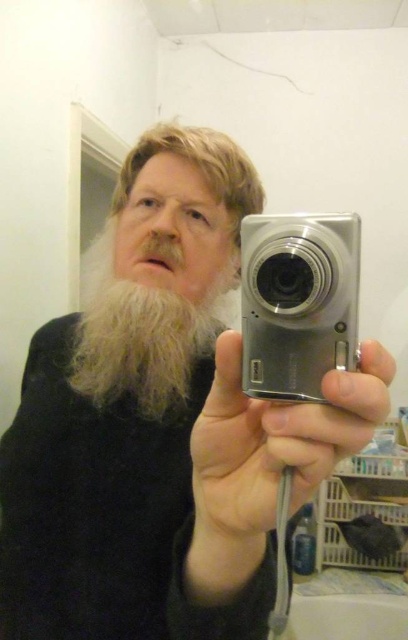
Question: Which of the following is the closest to the observer?

Choices:
 (A) (166, 340)
 (B) (305, 392)

Answer: (B)

Question: Which point is farther from the camera taking this photo?

Choices:
 (A) (102, 272)
 (B) (246, 285)

Answer: (A)

Question: Is silver metallic camera at center closer to the viewer compared to light brown fuzzy beard at center?

Choices:
 (A) yes
 (B) no

Answer: (A)

Question: Among these points, which one is farthest from the camera?

Choices:
 (A) (106, 248)
 (B) (330, 298)

Answer: (A)

Question: Does silver metallic camera at center appear under light brown fuzzy beard at center?

Choices:
 (A) yes
 (B) no

Answer: (B)

Question: Is silver metallic camera at center closer to camera compared to light brown fuzzy beard at center?

Choices:
 (A) yes
 (B) no

Answer: (A)